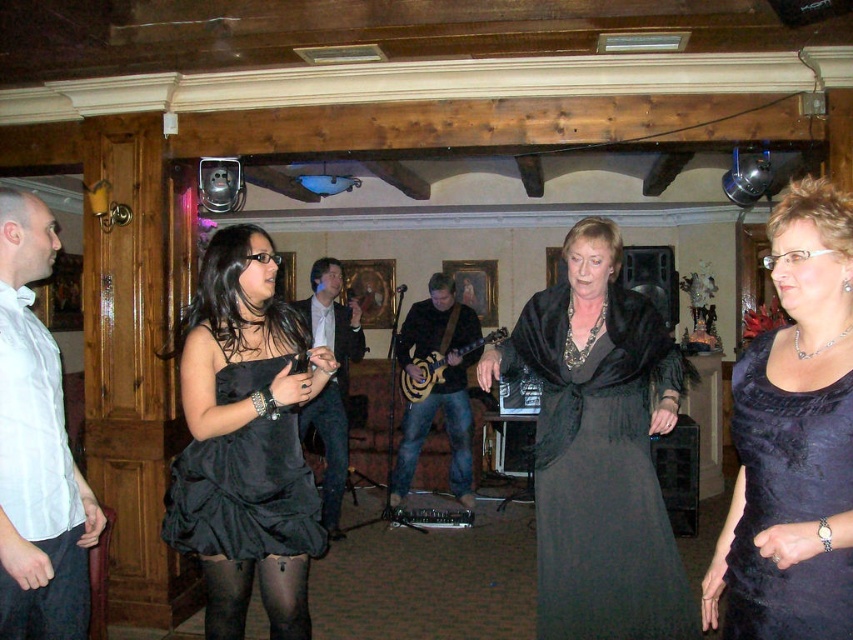
Identify the location of black satin dress at right. (788, 502).

Can you confirm if black satin dress at right is thinner than black fabric pants at lower left?

Incorrect, black satin dress at right's width is not less than black fabric pants at lower left's.

Which is behind, point (781, 474) or point (25, 604)?

The point (25, 604) is more distant.

Where is `black satin dress at right`? black satin dress at right is located at coordinates point(788,502).

The width and height of the screenshot is (853, 640). Find the location of `matte black dress at center`. matte black dress at center is located at coordinates (599, 449).

Which is more to the right, matte black dress at center or white satin shirt at left?

From the viewer's perspective, matte black dress at center appears more on the right side.

Who is more forward, (659, 369) or (86, 588)?

Point (86, 588) is more forward.

Locate an element on the screen. matte black dress at center is located at coordinates (599, 449).

Which is above, black satin dress at center or black fabric pants at lower left?

Positioned higher is black satin dress at center.

Can you confirm if black satin dress at center is wider than black fabric pants at lower left?

Yes, black satin dress at center is wider than black fabric pants at lower left.

Where is `black satin dress at center`? The height and width of the screenshot is (640, 853). black satin dress at center is located at coordinates (247, 442).